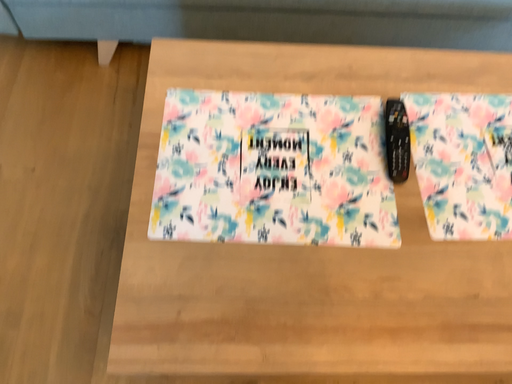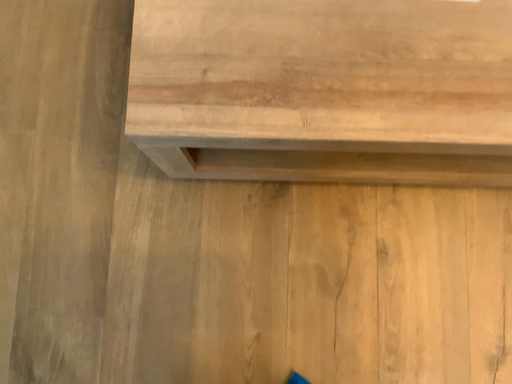
Question: How did the camera likely rotate when shooting the video?

Choices:
 (A) rotated downward
 (B) rotated upward

Answer: (A)